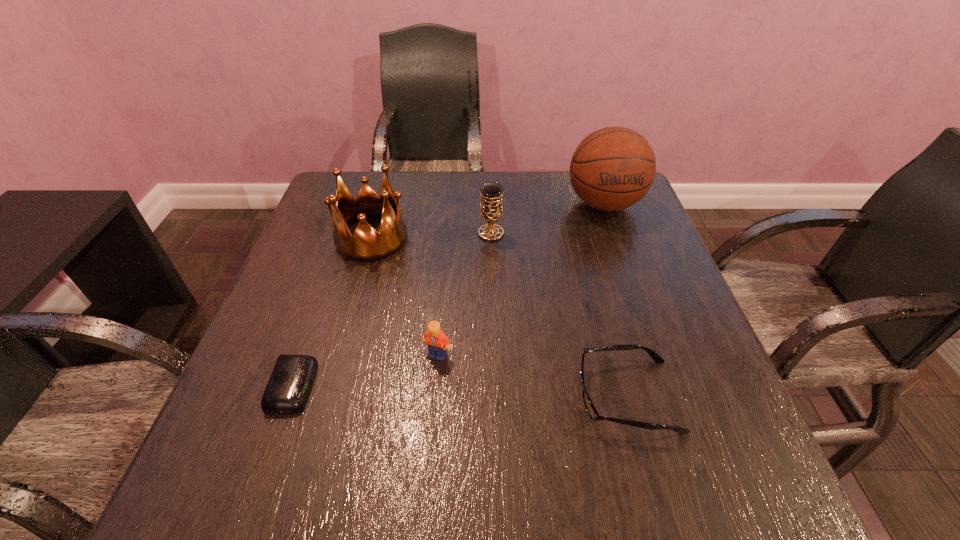
At what (x,y) coordinates should I click in order to perform the action: click on blank region between the fourth shortest object and the spectacles. Please return your answer as a coordinate pair (x, y). The height and width of the screenshot is (540, 960). Looking at the image, I should click on (559, 315).

The image size is (960, 540). What are the coordinates of `free point between the Lego and the chalice` in the screenshot? It's located at (465, 294).

The height and width of the screenshot is (540, 960). I want to click on vacant space that's between the shortest object and the second tallest object, so coord(332,312).

Locate an element on the screen. empty space that is in between the basketball and the alarm clock is located at coordinates (449, 295).

Where is `free space between the spectacles and the alarm clock`? free space between the spectacles and the alarm clock is located at coordinates (460, 391).

Locate an element on the screen. vacant area between the shortest object and the tallest object is located at coordinates (449, 295).

The height and width of the screenshot is (540, 960). I want to click on free spot between the spectacles and the third object from left to right, so click(x=532, y=375).

Identify the location of vacant space that's between the fourth shortest object and the second shortest object. This screenshot has height=540, width=960. (559, 315).

You are a GUI agent. You are given a task and a screenshot of the screen. Output one action in this format:
    pyautogui.click(x=<x>, y=<y>)
    Task: Click on the empty space between the tallest object and the Lego
    This screenshot has width=960, height=540.
    Given the screenshot: What is the action you would take?
    pyautogui.click(x=521, y=279)

Identify which object is the fifth closest to the fifth shortest object. Please provide its 2D coordinates. Your answer should be formatted as a tuple, i.e. [(x, y)], where the tuple contains the x and y coordinates of a point satisfying the conditions above.

[(590, 408)]